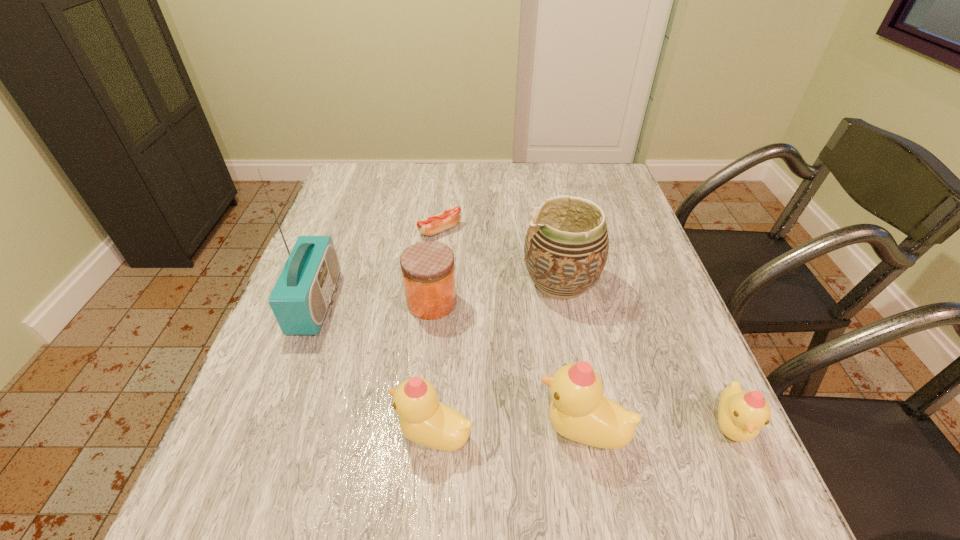
Identify the location of free spot located 0.080m on the front-facing side of the leftmost duckling. This screenshot has width=960, height=540. (349, 434).

Find the location of a particular element. This screenshot has height=540, width=960. free space located 0.160m on the front-facing side of the leftmost duckling is located at coordinates (305, 434).

Identify the location of free location located 0.160m on the front-facing side of the leftmost duckling. Image resolution: width=960 pixels, height=540 pixels. (305, 434).

I want to click on vacant space located 0.080m on the front-facing side of the second duckling from left to right, so click(493, 430).

Where is `vacant space situated on the front-facing side of the second duckling from left to right`? The image size is (960, 540). vacant space situated on the front-facing side of the second duckling from left to right is located at coordinates (460, 430).

Where is `vacant region located 0.320m on the front-facing side of the second duckling from left to right`? vacant region located 0.320m on the front-facing side of the second duckling from left to right is located at coordinates (361, 430).

The height and width of the screenshot is (540, 960). I want to click on vacant space located on the back of the shortest object, so click(447, 167).

Locate an element on the screen. vacant area situated on the front of the pottery is located at coordinates (578, 377).

Where is `free region located 0.080m on the front panel of the leftmost object`? free region located 0.080m on the front panel of the leftmost object is located at coordinates (369, 302).

This screenshot has width=960, height=540. In order to click on blank space located on the front of the jar in this screenshot , I will do `click(420, 400)`.